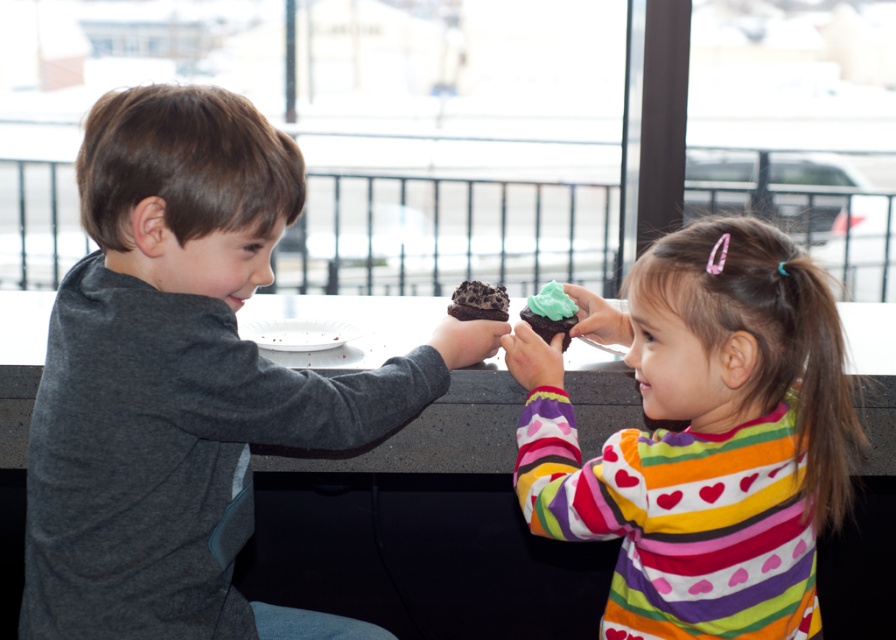
Question: Which point is closer to the camera?

Choices:
 (A) (418, 408)
 (B) (515, 362)

Answer: (A)

Question: Where is dark gray shirt at left located in relation to green frosting cupcake at center in the image?

Choices:
 (A) below
 (B) above

Answer: (A)

Question: Is pastel striped shirt at center positioned at the back of green frosting cupcake at center?

Choices:
 (A) yes
 (B) no

Answer: (B)

Question: Considering the real-world distances, which object is closest to the pastel striped shirt at center?

Choices:
 (A) chocolate cake at center
 (B) dark gray shirt at left
 (C) green frosting cupcake at center

Answer: (C)

Question: Estimate the real-world distances between objects in this image. Which object is closer to the dark gray shirt at left?

Choices:
 (A) pastel striped shirt at center
 (B) green frosting cupcake at center

Answer: (A)

Question: Does pastel striped shirt at center appear over chocolate cake at center?

Choices:
 (A) no
 (B) yes

Answer: (A)